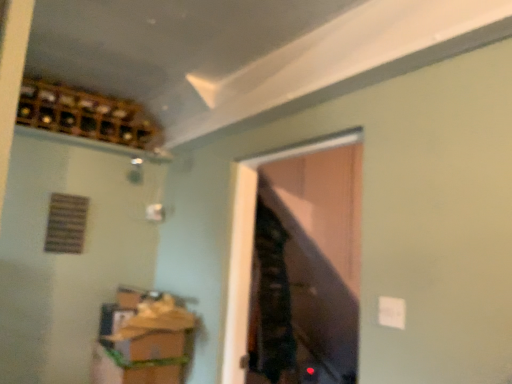
Question: Is wooden cabinet at lower left looking in the opposite direction of wooden wine rack at upper left?

Choices:
 (A) no
 (B) yes

Answer: (A)

Question: Does wooden cabinet at lower left have a greater width compared to wooden wine rack at upper left?

Choices:
 (A) yes
 (B) no

Answer: (A)

Question: Is wooden cabinet at lower left behind wooden wine rack at upper left?

Choices:
 (A) yes
 (B) no

Answer: (B)

Question: Can you confirm if wooden cabinet at lower left is shorter than wooden wine rack at upper left?

Choices:
 (A) no
 (B) yes

Answer: (A)

Question: Does wooden cabinet at lower left have a larger size compared to wooden wine rack at upper left?

Choices:
 (A) no
 (B) yes

Answer: (B)

Question: Relative to wooden wine rack at upper left, is transparent glass door at center in front or behind?

Choices:
 (A) front
 (B) behind

Answer: (A)

Question: From a real-world perspective, is transparent glass door at center above or below wooden wine rack at upper left?

Choices:
 (A) above
 (B) below

Answer: (B)

Question: In terms of width, does transparent glass door at center look wider or thinner when compared to wooden wine rack at upper left?

Choices:
 (A) wide
 (B) thin

Answer: (B)

Question: Is point (250, 264) positioned closer to the camera than point (76, 97)?

Choices:
 (A) farther
 (B) closer

Answer: (B)

Question: Considering their positions, is wooden wine rack at upper left located in front of or behind transparent glass door at center?

Choices:
 (A) front
 (B) behind

Answer: (B)

Question: Is wooden wine rack at upper left bigger or smaller than transparent glass door at center?

Choices:
 (A) small
 (B) big

Answer: (B)

Question: From the image's perspective, is wooden wine rack at upper left above or below transparent glass door at center?

Choices:
 (A) above
 (B) below

Answer: (A)

Question: From a real-world perspective, is wooden wine rack at upper left positioned above or below transparent glass door at center?

Choices:
 (A) above
 (B) below

Answer: (A)

Question: Is wooden wine rack at upper left inside the boundaries of wooden cabinet at lower left, or outside?

Choices:
 (A) inside
 (B) outside

Answer: (B)

Question: Considering the positions of point (130, 120) and point (124, 367), is point (130, 120) closer or farther from the camera than point (124, 367)?

Choices:
 (A) farther
 (B) closer

Answer: (A)